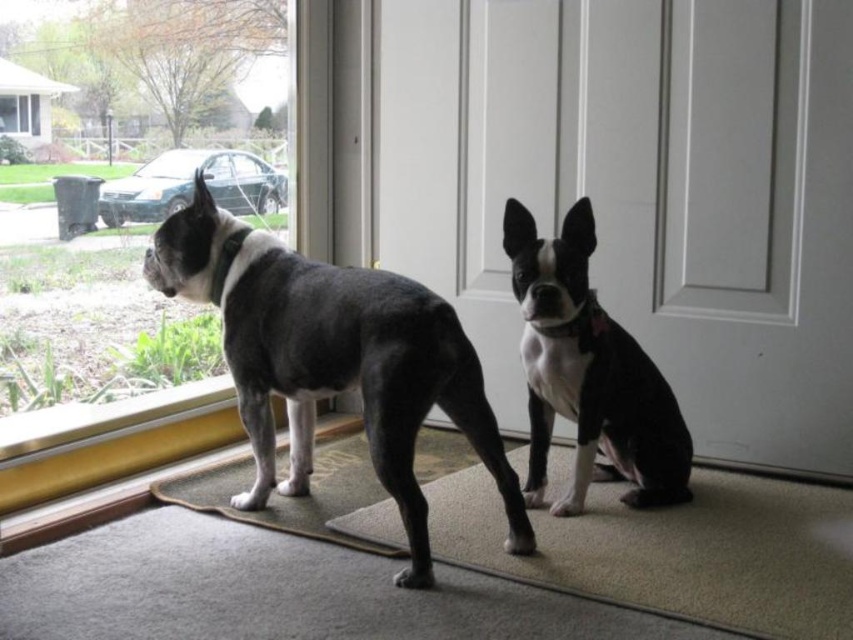
Looking at this image, you are a delivery person standing outside the house. You want to deliver a package to the dog on the right. The glass door at center is locked. To reach the dog on the right, you need to know where the door is located. According to the coordinates given, where is the white glossy door at center located?

The white glossy door at center is located at coordinates point (x=642, y=192).

You are a photographer trying to capture both the black and white fur dog at left and the transparent glass window at upper left in the same frame. Given their sizes, which one will appear bigger in your photo?

The black and white fur dog at left will appear bigger in the photo because it is larger in size than the transparent glass window at upper left.

You are a visitor at the house and you see the black and white fur dog at left and the transparent glass window at upper left. Which one is closer to the glass door?

The black and white fur dog at left is to the right of the transparent glass window at upper left, so the transparent glass window at upper left is closer to the glass door.